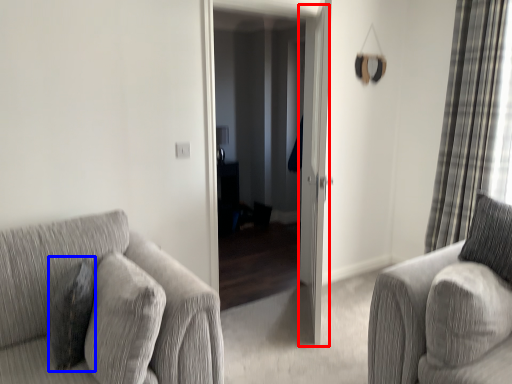
Question: Which point is closer to the camera, screen door (highlighted by a red box) or pillow (highlighted by a blue box)?

Choices:
 (A) screen door
 (B) pillow

Answer: (B)